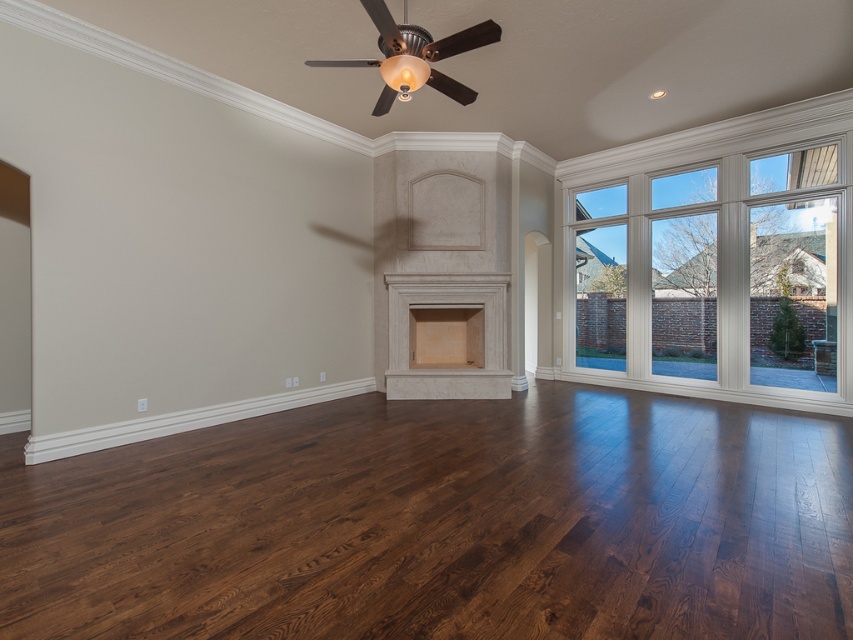
How far apart are matte stone fireplace at center and matte beige fireplace at center?

matte stone fireplace at center is 10.63 inches away from matte beige fireplace at center.

Is matte stone fireplace at center closer to the viewer compared to matte beige fireplace at center?

Yes, matte stone fireplace at center is closer to the viewer.

Image resolution: width=853 pixels, height=640 pixels. I want to click on matte stone fireplace at center, so click(447, 307).

I want to click on matte stone fireplace at center, so click(447, 307).

Which is behind, point (776, 356) or point (450, 374)?

The point (450, 374) is behind.

In the scene shown: Does clear glass windows at right have a lesser width compared to matte stone fireplace at center?

No.

Measure the distance between clear glass windows at right and camera.

clear glass windows at right is 5.26 meters from camera.

The height and width of the screenshot is (640, 853). In order to click on clear glass windows at right in this screenshot , I will do `click(721, 276)`.

Which of these two, dark brown wood flooring at center or clear glass windows at right, stands shorter?

Standing shorter between the two is dark brown wood flooring at center.

Looking at this image, is dark brown wood flooring at center above clear glass windows at right?

No.

This screenshot has height=640, width=853. What do you see at coordinates (442, 524) in the screenshot? I see `dark brown wood flooring at center` at bounding box center [442, 524].

Locate an element on the screen. The image size is (853, 640). dark brown wood flooring at center is located at coordinates (442, 524).